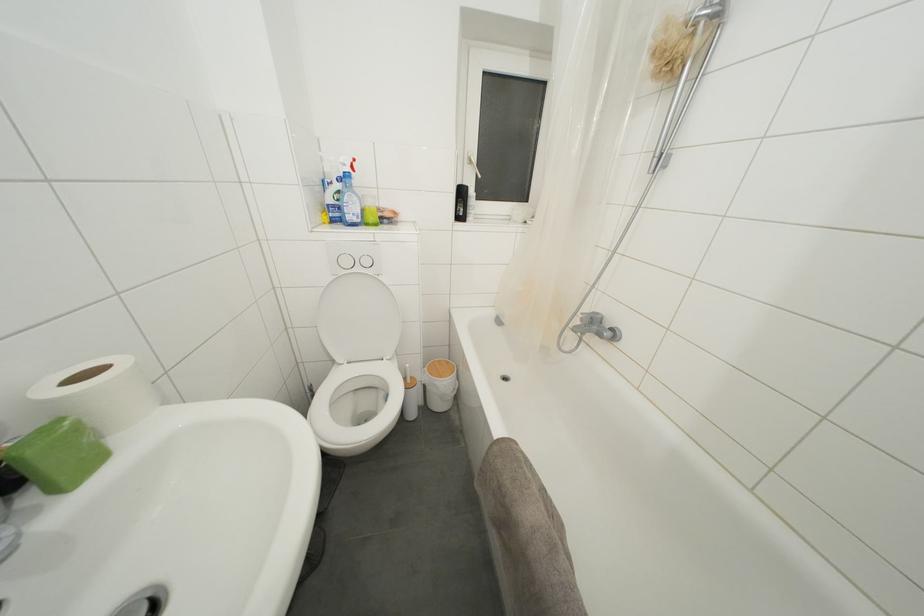
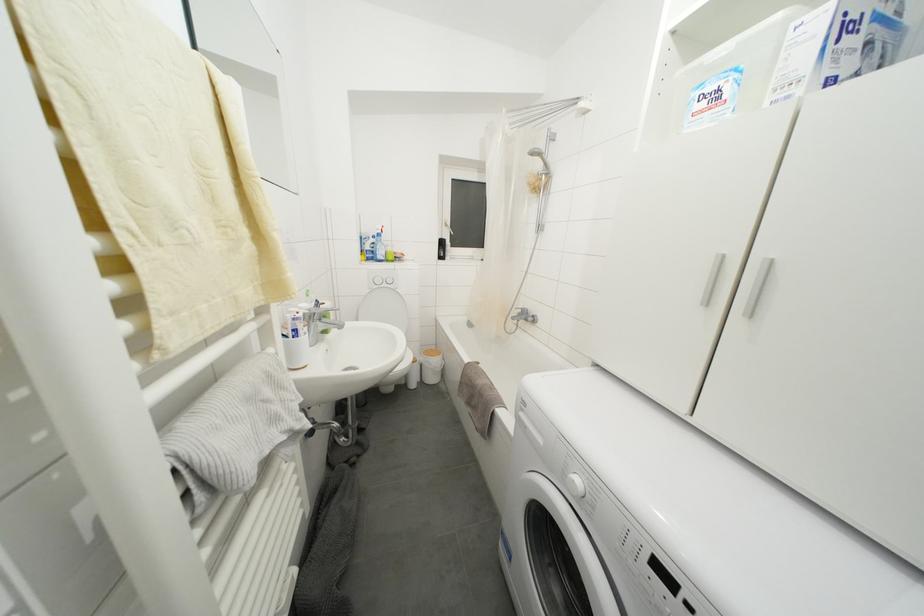
Question: How did the camera likely rotate?

Choices:
 (A) Left
 (B) Right
 (C) Up
 (D) Down

Answer: (C)